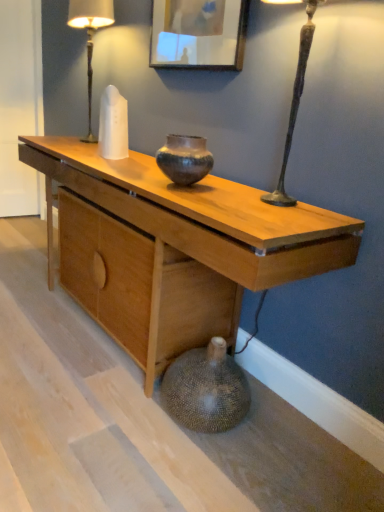
Question: From the image's perspective, relative to white glass table lamp at upper left, is natural wood desk at center above or below?

Choices:
 (A) above
 (B) below

Answer: (B)

Question: Would you say natural wood desk at center is inside or outside white glass table lamp at upper left?

Choices:
 (A) inside
 (B) outside

Answer: (B)

Question: Which is nearer to the earthy brown ceramic vase at center?

Choices:
 (A) wooden picture frame at upper center
 (B) white glass table lamp at upper left
 (C) natural wood desk at center

Answer: (C)

Question: Estimate the real-world distances between objects in this image. Which object is closer to the wooden picture frame at upper center?

Choices:
 (A) white glass table lamp at upper left
 (B) earthy brown ceramic vase at center
 (C) natural wood desk at center

Answer: (B)